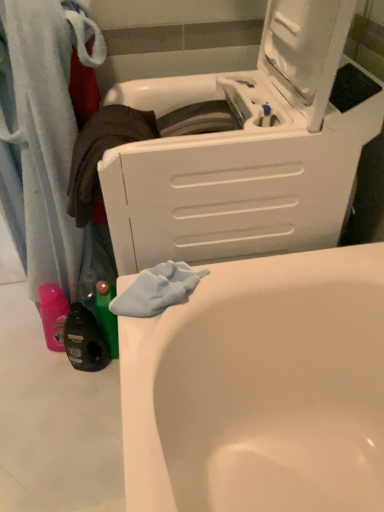
The height and width of the screenshot is (512, 384). What do you see at coordinates (260, 388) in the screenshot? I see `white glossy bathtub at lower left` at bounding box center [260, 388].

In order to face white glossy bathtub at lower left, should I rotate leftwards or rightwards?

To align with it, rotate left about 4.390°.

Where is `white glossy bathtub at lower left`? white glossy bathtub at lower left is located at coordinates (260, 388).

Describe the element at coordinates (248, 150) in the screenshot. The image size is (384, 512). I see `white plastic washing machine at upper center` at that location.

Find the location of a particular element. white plastic washing machine at upper center is located at coordinates (248, 150).

The width and height of the screenshot is (384, 512). Find the location of `white glossy bathtub at lower left`. white glossy bathtub at lower left is located at coordinates (260, 388).

In the image, is white plastic washing machine at upper center on the left side or the right side of white glossy bathtub at lower left?

white plastic washing machine at upper center is to the right of white glossy bathtub at lower left.

Is white plastic washing machine at upper center further to camera compared to white glossy bathtub at lower left?

No, it is in front of white glossy bathtub at lower left.

Considering the points (268, 196) and (196, 411), which point is in front, point (268, 196) or point (196, 411)?

The point (196, 411) is closer to the camera.

From the image's perspective, which object appears higher, white plastic washing machine at upper center or white glossy bathtub at lower left?

white plastic washing machine at upper center is shown above in the image.

From a real-world perspective, is white plastic washing machine at upper center located higher than white glossy bathtub at lower left?

Yes, from a real-world perspective, white plastic washing machine at upper center is over white glossy bathtub at lower left

Between white plastic washing machine at upper center and white glossy bathtub at lower left, which one has smaller width?

Thinner between the two is white plastic washing machine at upper center.

Who is taller, white plastic washing machine at upper center or white glossy bathtub at lower left?

Standing taller between the two is white plastic washing machine at upper center.

Considering the sizes of objects white plastic washing machine at upper center and white glossy bathtub at lower left in the image provided, who is smaller, white plastic washing machine at upper center or white glossy bathtub at lower left?

white glossy bathtub at lower left.

Is white plastic washing machine at upper center inside or outside of white glossy bathtub at lower left?

white plastic washing machine at upper center is outside white glossy bathtub at lower left.

Are white plastic washing machine at upper center and white glossy bathtub at lower left far apart?

They are positioned close to each other.

From the picture: Is white glossy bathtub at lower left at the back of white plastic washing machine at upper center?

That's not correct — white plastic washing machine at upper center is not looking away from white glossy bathtub at lower left.

How different are the orientations of white plastic washing machine at upper center and white glossy bathtub at lower left in degrees?

90 degrees separate the facing orientations of white plastic washing machine at upper center and white glossy bathtub at lower left.

Measure the distance between white plastic washing machine at upper center and white glossy bathtub at lower left.

A distance of 12.31 inches exists between white plastic washing machine at upper center and white glossy bathtub at lower left.

Where is `bathtub behind the white plastic washing machine at upper center`? The width and height of the screenshot is (384, 512). bathtub behind the white plastic washing machine at upper center is located at coordinates (260, 388).

Would you say white glossy bathtub at lower left is to the left or to the right of white plastic washing machine at upper center in the picture?

white glossy bathtub at lower left is positioned on white plastic washing machine at upper center's left side.

Which is in front, white glossy bathtub at lower left or white plastic washing machine at upper center?

white plastic washing machine at upper center is closer to the camera.

Does point (330, 262) appear closer or farther from the camera than point (271, 142)?

Point (330, 262) appears to be farther away from the viewer than point (271, 142).

From the image's perspective, between white glossy bathtub at lower left and white plastic washing machine at upper center, who is located below?

From the image's view, white glossy bathtub at lower left is below.

From a real-world perspective, who is located lower, white glossy bathtub at lower left or white plastic washing machine at upper center?

From a 3D spatial view, white glossy bathtub at lower left is below.

Does white glossy bathtub at lower left have a lesser width compared to white plastic washing machine at upper center?

Incorrect, the width of white glossy bathtub at lower left is not less than that of white plastic washing machine at upper center.

Who is taller, white glossy bathtub at lower left or white plastic washing machine at upper center?

Standing taller between the two is white plastic washing machine at upper center.

Does white glossy bathtub at lower left have a larger size compared to white plastic washing machine at upper center?

No.

From the picture: Is white glossy bathtub at lower left surrounding white plastic washing machine at upper center?

No, white glossy bathtub at lower left does not contain white plastic washing machine at upper center.

Are white glossy bathtub at lower left and white plastic washing machine at upper center far apart?

white glossy bathtub at lower left is actually quite close to white plastic washing machine at upper center.

Does white glossy bathtub at lower left turn towards white plastic washing machine at upper center?

No, white glossy bathtub at lower left is not aimed at white plastic washing machine at upper center.

Locate an element on the screen. washing machine that is above the white glossy bathtub at lower left (from the image's perspective) is located at coordinates (248, 150).

This screenshot has height=512, width=384. I want to click on washing machine in front of the white glossy bathtub at lower left, so click(x=248, y=150).

Find the location of a particular element. bathtub that appears behind the white plastic washing machine at upper center is located at coordinates (260, 388).